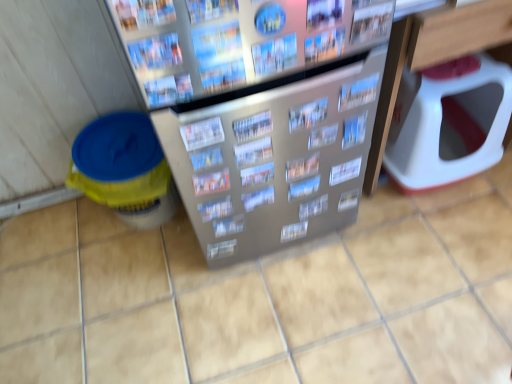
Describe the element at coordinates (155, 52) in the screenshot. I see `printed paper magazine at upper center, placed as the 2th magazine when sorted from front to back` at that location.

Where is `metallic silver magazine at upper center, positioned as the 7th magazine in back-to-front order`? metallic silver magazine at upper center, positioned as the 7th magazine in back-to-front order is located at coordinates (371, 20).

How much space does metallic silver magazine at center, the tenth magazine positioned from the back, occupy vertically?

The height of metallic silver magazine at center, the tenth magazine positioned from the back, is 2.85 inches.

Describe the element at coordinates (308, 114) in the screenshot. I see `metallic silver magazine at center, the 3th magazine positioned from the back` at that location.

At what (x,y) coordinates should I click in order to perform the action: click on matte paper magazine at upper center, which is the 8th magazine from back to front. Please return your answer as a coordinate pair (x, y). The image size is (512, 384). Looking at the image, I should click on (324, 45).

Locate an element on the screen. Image resolution: width=512 pixels, height=384 pixels. metallic silver magazine at center, the 9th magazine in the back-to-front sequence is located at coordinates (222, 74).

Find the location of a particular element. The width and height of the screenshot is (512, 384). printed paper magazine at upper center, positioned as the 12th magazine in back-to-front order is located at coordinates (155, 52).

Is point (200, 68) closer or farther from the camera than point (380, 32)?

Point (200, 68) is closer to the camera than point (380, 32).

From the image's perspective, which is above, metallic silver magazine at center, the 9th magazine in the back-to-front sequence, or metallic silver magazine at upper center, marked as the seventh magazine in a front-to-back arrangement?

From the image's view, metallic silver magazine at upper center, marked as the seventh magazine in a front-to-back arrangement, is above.

Does metallic silver magazine at center, the 9th magazine in the back-to-front sequence, come in front of metallic silver magazine at upper center, positioned as the 7th magazine in back-to-front order?

Yes, metallic silver magazine at center, the 9th magazine in the back-to-front sequence, is closer to the viewer.

Is blue glossy magazine at center, placed as the thirteenth magazine when sorted from front to back, inside printed paper magazine at center, marked as the 8th magazine in a front-to-back arrangement?

Actually, blue glossy magazine at center, placed as the thirteenth magazine when sorted from front to back, is outside printed paper magazine at center, marked as the 8th magazine in a front-to-back arrangement.

In terms of height, does printed paper magazine at center, marked as the 8th magazine in a front-to-back arrangement, look taller or shorter compared to blue glossy magazine at center, the 1th magazine in the back-to-front sequence?

In the image, printed paper magazine at center, marked as the 8th magazine in a front-to-back arrangement, appears to be shorter than blue glossy magazine at center, the 1th magazine in the back-to-front sequence.

Does printed paper magazine at center, marked as the 8th magazine in a front-to-back arrangement, touch blue glossy magazine at center, the 1th magazine in the back-to-front sequence?

They are not placed beside each other.

From the image's perspective, between printed paper magazine at center, marked as the 8th magazine in a front-to-back arrangement, and blue glossy magazine at center, the 1th magazine in the back-to-front sequence, who is located below?

printed paper magazine at center, marked as the 8th magazine in a front-to-back arrangement.

Is printed paper magazine at center, the ninth magazine from the front, positioned behind metallic silver magazine at center, placed as the 11th magazine when sorted from front to back?

No, it is not.

Considering the relative sizes of printed paper magazine at center, which appears as the 5th magazine when viewed from the back, and metallic silver magazine at center, placed as the 11th magazine when sorted from front to back, in the image provided, is printed paper magazine at center, which appears as the 5th magazine when viewed from the back, bigger than metallic silver magazine at center, placed as the 11th magazine when sorted from front to back,?

Yes, printed paper magazine at center, which appears as the 5th magazine when viewed from the back, is bigger than metallic silver magazine at center, placed as the 11th magazine when sorted from front to back.

From the image's perspective, which is below, printed paper magazine at center, which appears as the 5th magazine when viewed from the back, or metallic silver magazine at center, the 3th magazine positioned from the back?

printed paper magazine at center, which appears as the 5th magazine when viewed from the back, appears lower in the image.

You are a GUI agent. You are given a task and a screenshot of the screen. Output one action in this format:
    pyautogui.click(x=<x>, y=<y>)
    Task: Click on the 2nd magazine above the printed paper magazine at center, the ninth magazine from the front (from the image's perspective)
    The height and width of the screenshot is (384, 512).
    Given the screenshot: What is the action you would take?
    pyautogui.click(x=308, y=114)

Based on the photo, how distant is matte paper magazine at upper center, which is the 8th magazine from back to front, from metallic silver magazine at center, the 4th magazine from the front?

matte paper magazine at upper center, which is the 8th magazine from back to front, is 6.65 centimeters from metallic silver magazine at center, the 4th magazine from the front.

From the image's perspective, which is below, matte paper magazine at upper center, which is the 8th magazine from back to front, or metallic silver magazine at center, the tenth magazine positioned from the back?

metallic silver magazine at center, the tenth magazine positioned from the back, is shown below in the image.

Consider the image. Considering their positions, is matte paper magazine at upper center, which is counted as the sixth magazine, starting from the front, located in front of or behind metallic silver magazine at center, the 4th magazine from the front?

matte paper magazine at upper center, which is counted as the sixth magazine, starting from the front, is positioned farther from the viewer than metallic silver magazine at center, the 4th magazine from the front.

Visually, is matte paper magazine at upper center, which is the 8th magazine from back to front, positioned to the left or to the right of metallic silver magazine at center, the 4th magazine from the front?

matte paper magazine at upper center, which is the 8th magazine from back to front, is positioned on metallic silver magazine at center, the 4th magazine from the front,'s right side.

Does printed paper magazine at center, which is counted as the 6th magazine, starting from the back, have a lesser width compared to metallic silver magazine at center, the 4th magazine from the front?

No.

Could you tell me if printed paper magazine at center, which is counted as the 6th magazine, starting from the back, is turned towards metallic silver magazine at center, the 4th magazine from the front?

No.

From the image's perspective, is printed paper magazine at center, which is counted as the 6th magazine, starting from the back, positioned above or below metallic silver magazine at center, the tenth magazine positioned from the back?

printed paper magazine at center, which is counted as the 6th magazine, starting from the back, is situated lower than metallic silver magazine at center, the tenth magazine positioned from the back, in the image.

Is point (193, 135) farther from viewer compared to point (259, 65)?

Yes, point (193, 135) is farther from viewer.

Is point (144, 178) closer or farther from the camera than point (362, 132)?

Clearly, point (144, 178) is more distant from the camera than point (362, 132).

Is yellow plastic bucket at left oriented towards blue glossy magazine at center, the 1th magazine in the back-to-front sequence?

No.

From the image's perspective, is printed paper magazine at center, arranged as the 12th magazine when viewed from the front, beneath metallic silver magazine at center, which is the fifth magazine from front to back?

Yes.

Considering the relative positions of printed paper magazine at center, arranged as the 12th magazine when viewed from the front, and metallic silver magazine at center, which is the fifth magazine from front to back, in the image provided, is printed paper magazine at center, arranged as the 12th magazine when viewed from the front, behind metallic silver magazine at center, which is the fifth magazine from front to back,?

Yes, it is behind metallic silver magazine at center, which is the fifth magazine from front to back.

Between printed paper magazine at center, positioned as the 2th magazine in back-to-front order, and metallic silver magazine at center, which is the fifth magazine from front to back, which one has smaller size?

metallic silver magazine at center, which is the fifth magazine from front to back.

What's the angular difference between printed paper magazine at center, positioned as the 2th magazine in back-to-front order, and metallic silver magazine at center, the 9th magazine in the back-to-front sequence,'s facing directions?

The facing directions of printed paper magazine at center, positioned as the 2th magazine in back-to-front order, and metallic silver magazine at center, the 9th magazine in the back-to-front sequence, are 0.0018 degrees apart.

Where is `magazine that is the 6th object located below the metallic silver magazine at upper center, positioned as the 7th magazine in back-to-front order (from the image's perspective)`? Image resolution: width=512 pixels, height=384 pixels. magazine that is the 6th object located below the metallic silver magazine at upper center, positioned as the 7th magazine in back-to-front order (from the image's perspective) is located at coordinates (222, 74).

This screenshot has width=512, height=384. I want to click on the 5th magazine positioned above the blue glossy magazine at center, placed as the thirteenth magazine when sorted from front to back (from a real-world perspective), so click(x=202, y=133).

Based on their spatial positions, is blue glossy magazine at center, the 1th magazine in the back-to-front sequence, or printed paper magazine at center, the eleventh magazine in the back-to-front sequence, closer to metallic silver magazine at upper center, positioned as the 7th magazine in back-to-front order?

blue glossy magazine at center, the 1th magazine in the back-to-front sequence, lies closer to metallic silver magazine at upper center, positioned as the 7th magazine in back-to-front order, than the other object.

Based on the photo, which object lies nearer to the anchor point yellow plastic bucket at left, white plastic toilet at right or metallic silver magazine at upper center, positioned as the 7th magazine in back-to-front order?

metallic silver magazine at upper center, positioned as the 7th magazine in back-to-front order.

From the picture: When comparing their distances from metallic silver magazine at center, which appears as the fourth magazine when viewed from the back, does metallic silver magazine at upper center, marked as the seventh magazine in a front-to-back arrangement, or printed paper magazine at center, arranged as the 12th magazine when viewed from the front, seem closer?

metallic silver magazine at upper center, marked as the seventh magazine in a front-to-back arrangement, is positioned closer to the anchor metallic silver magazine at center, which appears as the fourth magazine when viewed from the back.

Looking at the image, which one is located closer to printed paper magazine at center, positioned as the 2th magazine in back-to-front order, yellow plastic bucket at left or blue glossy magazine at center, placed as the thirteenth magazine when sorted from front to back?

The object closer to printed paper magazine at center, positioned as the 2th magazine in back-to-front order, is blue glossy magazine at center, placed as the thirteenth magazine when sorted from front to back.

Consider the image. Estimate the real-world distances between objects in this image. Which object is further from yellow plastic bucket at left, matte paper magazine at upper center, which is the 8th magazine from back to front, or metallic silver magazine at upper center, marked as the seventh magazine in a front-to-back arrangement?

metallic silver magazine at upper center, marked as the seventh magazine in a front-to-back arrangement, is further to yellow plastic bucket at left.

Based on their spatial positions, is white plastic toilet at right or metallic silver magazine at center, the tenth magazine in the front-to-back sequence, further from metallic silver magazine at center, the 4th magazine from the front?

The object further to metallic silver magazine at center, the 4th magazine from the front, is white plastic toilet at right.

Looking at the image, which one is located further to printed paper magazine at upper left, which appears as the thirteenth magazine when viewed from the back, printed paper magazine at center, which is counted as the 6th magazine, starting from the back, or metallic silver magazine at center, the 4th magazine from the front?

Based on the image, printed paper magazine at center, which is counted as the 6th magazine, starting from the back, appears to be further to printed paper magazine at upper left, which appears as the thirteenth magazine when viewed from the back.

From the image, which object appears to be nearer to metallic silver magazine at center, placed as the 11th magazine when sorted from front to back, white plastic toilet at right or metallic silver magazine at center, the 4th magazine from the front?

metallic silver magazine at center, the 4th magazine from the front, lies closer to metallic silver magazine at center, placed as the 11th magazine when sorted from front to back, than the other object.

Image resolution: width=512 pixels, height=384 pixels. I want to click on magazine between metallic silver magazine at center, which appears as the fourth magazine when viewed from the back, and white plastic toilet at right, so click(x=354, y=130).

Locate an element on the screen. The image size is (512, 384). magazine positioned between printed paper magazine at upper left, which appears as the thirteenth magazine when viewed from the back, and printed paper magazine at center, acting as the third magazine starting from the front, from near to far is located at coordinates (155, 52).